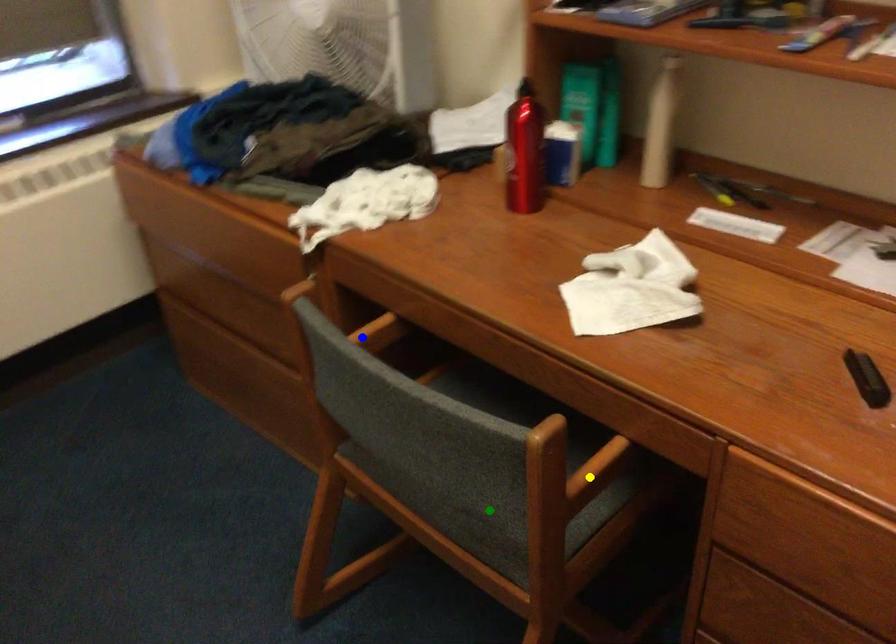
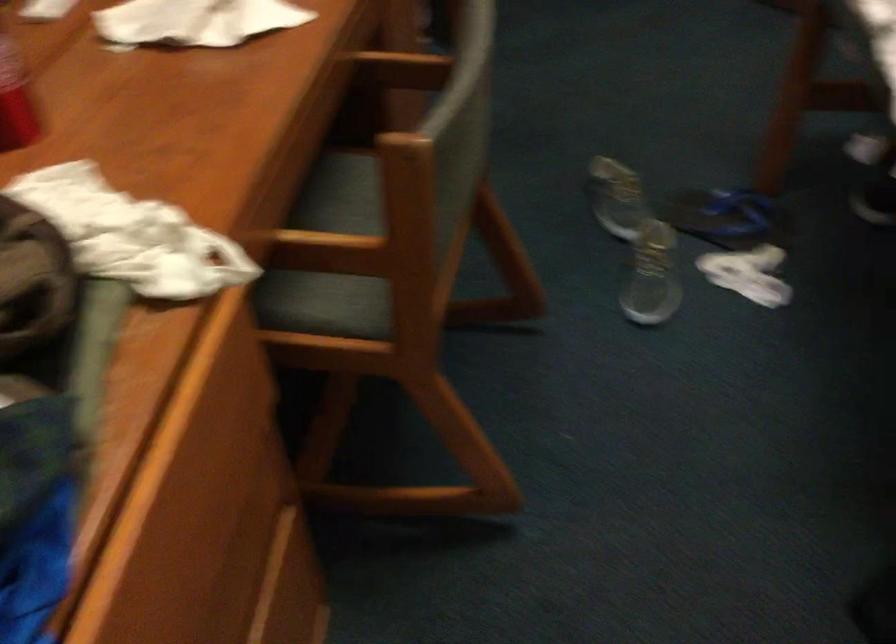
I am providing you with two images of the same scene from different viewpoints. Three points are marked in image1. Which point corresponds to a part or object that is occluded in image2?In image1, three points are marked. Which of them correspond to a part or object that is occluded in image2?Among the three points shown in image1, which one corresponds to a part or object that is no longer visible due to occlusion in image2?

green point cannot be seen in image2.